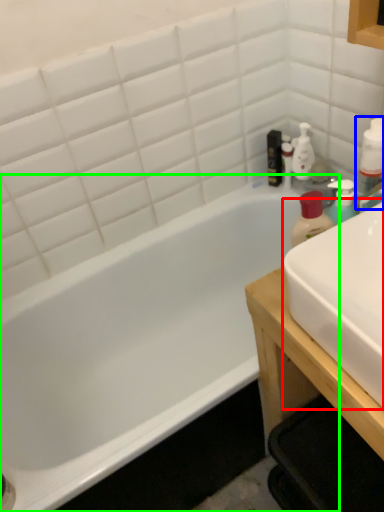
Question: Considering the real-world distances, which object is closest to sink (highlighted by a red box)? bottle (highlighted by a blue box) or bathtub (highlighted by a green box).

Choices:
 (A) bottle
 (B) bathtub

Answer: (A)